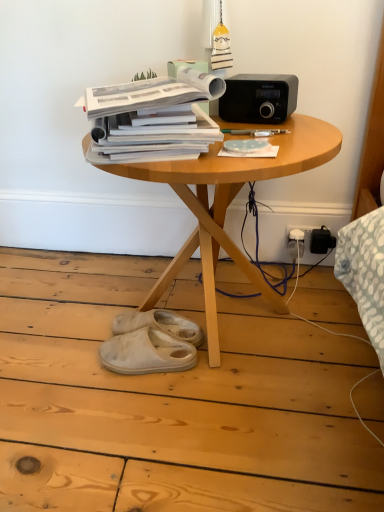
What do you see at coordinates (228, 205) in the screenshot?
I see `wooden table at center` at bounding box center [228, 205].

How much space does blue dotted paper at center, which ranks as the second paperback book in left-to-right order, occupy horizontally?

blue dotted paper at center, which ranks as the second paperback book in left-to-right order, is 12.00 centimeters wide.

You are a GUI agent. You are given a task and a screenshot of the screen. Output one action in this format:
    pyautogui.click(x=<x>, y=<y>)
    Task: Click on the blue dotted paper at center, positioned as the first paperback book in right-to-left order
    
    Given the screenshot: What is the action you would take?
    pyautogui.click(x=248, y=148)

In order to face white suede slippers at lower center, which is the 1th footwear in front-to-back order, should I rotate leftwards or rightwards?

A 6.216 degree turn to the left will do.

Identify the location of white paper at center, arranged as the first paperback book when viewed from the left. This screenshot has height=512, width=384. (153, 118).

You are a GUI agent. You are given a task and a screenshot of the screen. Output one action in this format:
    pyautogui.click(x=<x>, y=<y>)
    Task: Click on the wooden table at center
    
    Given the screenshot: What is the action you would take?
    pyautogui.click(x=228, y=205)

Consider the image. From the image's perspective, is black matte stereo at upper right above or below white paper at center, arranged as the first paperback book when viewed from the left?

Based on their image positions, black matte stereo at upper right is located above white paper at center, arranged as the first paperback book when viewed from the left.

Considering the sizes of objects black matte stereo at upper right and white paper at center, arranged as the first paperback book when viewed from the left, in the image provided, who is taller, black matte stereo at upper right or white paper at center, arranged as the first paperback book when viewed from the left,?

black matte stereo at upper right is taller.

Who is smaller, black matte stereo at upper right or white paper at center, placed as the second paperback book when sorted from right to left?

black matte stereo at upper right is smaller.

Is white suede slippers at lower center, which is the 1th footwear in front-to-back order, taller or shorter than blue dotted paper at center, which ranks as the second paperback book in left-to-right order?

Considering their sizes, white suede slippers at lower center, which is the 1th footwear in front-to-back order, has more height than blue dotted paper at center, which ranks as the second paperback book in left-to-right order.

From the image's perspective, count 1st paperback books upward from the white suede slippers at lower center, which is the second footwear in back-to-front order, and point to it. Please provide its 2D coordinates.

[(248, 148)]

In terms of size, does white suede slippers at lower center, which is the second footwear in back-to-front order, appear bigger or smaller than blue dotted paper at center, positioned as the first paperback book in right-to-left order?

Clearly, white suede slippers at lower center, which is the second footwear in back-to-front order, is larger in size than blue dotted paper at center, positioned as the first paperback book in right-to-left order.

Which point is more forward, (116, 343) or (260, 146)?

The point (260, 146) is in front.

Is white paper at center, placed as the second paperback book when sorted from right to left, positioned beyond the bounds of white suede slippers at lower center, which is the 1th footwear in front-to-back order?

Yes, white paper at center, placed as the second paperback book when sorted from right to left, is not within white suede slippers at lower center, which is the 1th footwear in front-to-back order.

Between white paper at center, arranged as the first paperback book when viewed from the left, and white suede slippers at lower center, which is the second footwear in back-to-front order, which one has larger size?

With larger size is white paper at center, arranged as the first paperback book when viewed from the left.

Consider the image. Considering the sizes of objects white paper at center, placed as the second paperback book when sorted from right to left, and white suede slippers at lower center, which is the 1th footwear in front-to-back order, in the image provided, who is shorter, white paper at center, placed as the second paperback book when sorted from right to left, or white suede slippers at lower center, which is the 1th footwear in front-to-back order,?

With less height is white suede slippers at lower center, which is the 1th footwear in front-to-back order.

Is white paper at center, arranged as the first paperback book when viewed from the left, oriented away from white suede slippers at lower center, which is the second footwear in back-to-front order?

That's not correct — white paper at center, arranged as the first paperback book when viewed from the left, is not looking away from white suede slippers at lower center, which is the second footwear in back-to-front order.

Does white suede slippers at lower center, which is the 1th footwear in front-to-back order, come in front of black matte stereo at upper right?

No, it is not.

Where is `stereo above the white suede slippers at lower center, which is the second footwear in back-to-front order (from the image's perspective)`? This screenshot has width=384, height=512. stereo above the white suede slippers at lower center, which is the second footwear in back-to-front order (from the image's perspective) is located at coordinates (259, 98).

From the image's perspective, who appears lower, white suede slippers at lower center, marked as the second footwear in a front-to-back arrangement, or white suede slippers at lower center, which is the second footwear in back-to-front order?

white suede slippers at lower center, which is the second footwear in back-to-front order, appears lower in the image.

Consider the image. Is white suede slippers at lower center, marked as the second footwear in a front-to-back arrangement, looking in the opposite direction of white suede slippers at lower center, which is the second footwear in back-to-front order?

white suede slippers at lower center, marked as the second footwear in a front-to-back arrangement, is not turned away from white suede slippers at lower center, which is the second footwear in back-to-front order.

Considering the positions of points (154, 313) and (139, 330), is point (154, 313) farther from camera compared to point (139, 330)?

That is True.

Considering the sizes of objects white paper at center, arranged as the first paperback book when viewed from the left, and black matte stereo at upper right in the image provided, who is shorter, white paper at center, arranged as the first paperback book when viewed from the left, or black matte stereo at upper right?

white paper at center, arranged as the first paperback book when viewed from the left, is shorter.

Which of these two, white paper at center, arranged as the first paperback book when viewed from the left, or black matte stereo at upper right, is thinner?

black matte stereo at upper right is thinner.

Which is behind, white paper at center, placed as the second paperback book when sorted from right to left, or black matte stereo at upper right?

black matte stereo at upper right.

Which is closer, (122, 98) or (224, 111)?

Point (122, 98) is closer to the camera than point (224, 111).

How far apart are wooden table at center and white suede slippers at lower center, which is the second footwear in back-to-front order?

The distance of wooden table at center from white suede slippers at lower center, which is the second footwear in back-to-front order, is 11.98 inches.

Does wooden table at center come behind white suede slippers at lower center, which is the 1th footwear in front-to-back order?

That is False.

Does wooden table at center appear on the right side of white suede slippers at lower center, which is the second footwear in back-to-front order?

Correct, you'll find wooden table at center to the right of white suede slippers at lower center, which is the second footwear in back-to-front order.

Is point (155, 296) less distant than point (130, 332)?

That is False.

Locate an element on the screen. The image size is (384, 512). the 2nd paperback book in front of the black matte stereo at upper right is located at coordinates (153, 118).

Where is `the 2nd paperback book counting from the right side of the white suede slippers at lower center, which is the 1th footwear in front-to-back order`? This screenshot has width=384, height=512. the 2nd paperback book counting from the right side of the white suede slippers at lower center, which is the 1th footwear in front-to-back order is located at coordinates (248, 148).

Estimate the real-world distances between objects in this image. Which object is further from wooden table at center, blue dotted paper at center, positioned as the first paperback book in right-to-left order, or black matte stereo at upper right?

black matte stereo at upper right is further to wooden table at center.

Estimate the real-world distances between objects in this image. Which object is further from white paper at center, placed as the second paperback book when sorted from right to left, white suede slippers at lower center, which is the 1th footwear in front-to-back order, or black matte stereo at upper right?

Among the two, white suede slippers at lower center, which is the 1th footwear in front-to-back order, is located further to white paper at center, placed as the second paperback book when sorted from right to left.

Which object lies further to the anchor point blue dotted paper at center, which ranks as the second paperback book in left-to-right order, black matte stereo at upper right or white paper at center, placed as the second paperback book when sorted from right to left?

black matte stereo at upper right is further to blue dotted paper at center, which ranks as the second paperback book in left-to-right order.

When comparing their distances from wooden table at center, does black matte stereo at upper right or white suede slippers at lower center, marked as the second footwear in a front-to-back arrangement, seem further?

Based on the image, white suede slippers at lower center, marked as the second footwear in a front-to-back arrangement, appears to be further to wooden table at center.

Estimate the real-world distances between objects in this image. Which object is closer to white paper at center, arranged as the first paperback book when viewed from the left, blue dotted paper at center, which ranks as the second paperback book in left-to-right order, or wooden table at center?

The object closer to white paper at center, arranged as the first paperback book when viewed from the left, is blue dotted paper at center, which ranks as the second paperback book in left-to-right order.

Based on their spatial positions, is white suede slippers at lower center, positioned as the first footwear in back-to-front order, or wooden table at center closer to blue dotted paper at center, which ranks as the second paperback book in left-to-right order?

wooden table at center lies closer to blue dotted paper at center, which ranks as the second paperback book in left-to-right order, than the other object.

When comparing their distances from white paper at center, arranged as the first paperback book when viewed from the left, does wooden table at center or black matte stereo at upper right seem further?

Among the two, black matte stereo at upper right is located further to white paper at center, arranged as the first paperback book when viewed from the left.

When comparing their distances from wooden table at center, does white suede slippers at lower center, positioned as the first footwear in back-to-front order, or white paper at center, arranged as the first paperback book when viewed from the left, seem closer?

Result: Based on the image, white paper at center, arranged as the first paperback book when viewed from the left, appears to be nearer to wooden table at center.

You are a GUI agent. You are given a task and a screenshot of the screen. Output one action in this format:
    pyautogui.click(x=<x>, y=<y>)
    Task: Click on the footwear located between wooden table at center and white suede slippers at lower center, positioned as the first footwear in back-to-front order, in the depth direction
    Image resolution: width=384 pixels, height=512 pixels.
    Given the screenshot: What is the action you would take?
    pyautogui.click(x=147, y=353)

Where is `table that lies between black matte stereo at upper right and white suede slippers at lower center, which is the second footwear in back-to-front order, from top to bottom`? Image resolution: width=384 pixels, height=512 pixels. table that lies between black matte stereo at upper right and white suede slippers at lower center, which is the second footwear in back-to-front order, from top to bottom is located at coordinates (228, 205).

Where is `footwear between black matte stereo at upper right and white suede slippers at lower center, which is the 1th footwear in front-to-back order, vertically`? The width and height of the screenshot is (384, 512). footwear between black matte stereo at upper right and white suede slippers at lower center, which is the 1th footwear in front-to-back order, vertically is located at coordinates (159, 324).

Find the location of a particular element. The height and width of the screenshot is (512, 384). table between black matte stereo at upper right and white suede slippers at lower center, positioned as the first footwear in back-to-front order, from top to bottom is located at coordinates (228, 205).